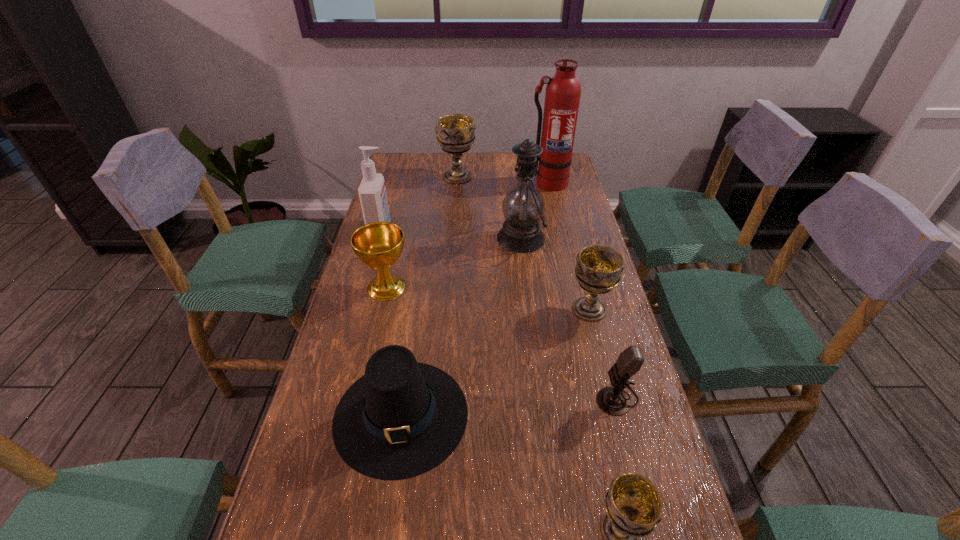
Select which white chalice appears as the closest to the microphone. Please provide its 2D coordinates. Your answer should be formatted as a tuple, i.e. [(x, y)], where the tuple contains the x and y coordinates of a point satisfying the conditions above.

[(599, 268)]

Locate which white chalice ranks second in proximity to the fire extinguisher. Please provide its 2D coordinates. Your answer should be formatted as a tuple, i.e. [(x, y)], where the tuple contains the x and y coordinates of a point satisfying the conditions above.

[(599, 268)]

Locate an element on the screen. vacant space that satisfies the following two spatial constraints: 1. on the front label of the cleansing agent; 2. on the right side of the second nearest white chalice is located at coordinates (358, 309).

Where is `vacant space that satisfies the following two spatial constraints: 1. on the back side of the leftmost chalice; 2. on the front label of the seventh shortest object`? The height and width of the screenshot is (540, 960). vacant space that satisfies the following two spatial constraints: 1. on the back side of the leftmost chalice; 2. on the front label of the seventh shortest object is located at coordinates (400, 229).

The image size is (960, 540). Find the location of `vacant area that satisfies the following two spatial constraints: 1. on the back side of the gold chalice; 2. on the left side of the gray oil lamp`. vacant area that satisfies the following two spatial constraints: 1. on the back side of the gold chalice; 2. on the left side of the gray oil lamp is located at coordinates (397, 238).